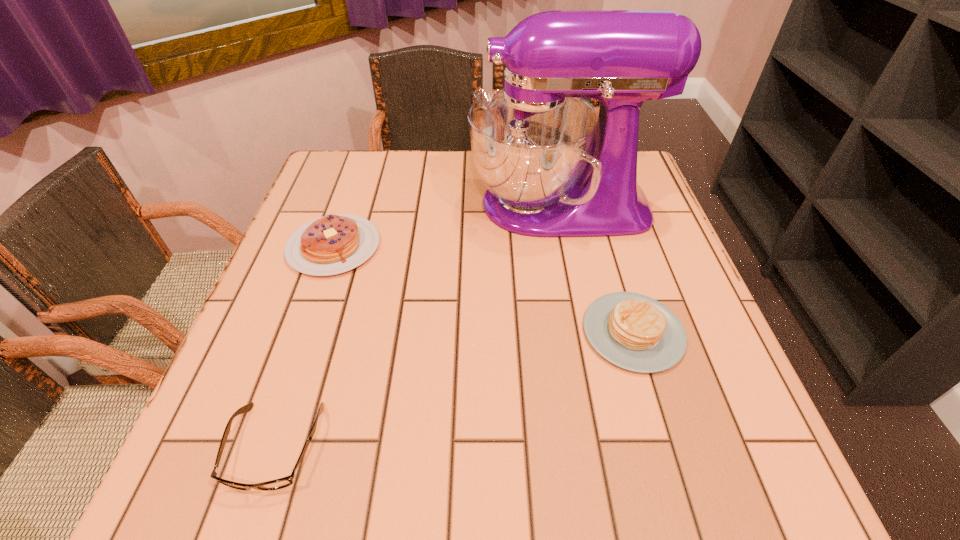
Find the location of `free spot between the mixer and the third farthest object`. free spot between the mixer and the third farthest object is located at coordinates (596, 268).

Find the location of a particular element. free area in between the spectacles and the third farthest object is located at coordinates (454, 389).

Locate an element on the screen. free space between the left pancake and the mixer is located at coordinates (446, 226).

The width and height of the screenshot is (960, 540). I want to click on object that is the third closest one to the right pancake, so click(284, 482).

The height and width of the screenshot is (540, 960). What are the coordinates of `the third closest object relative to the left pancake` in the screenshot? It's located at (635, 332).

Find the location of a particular element. The height and width of the screenshot is (540, 960). free spot that satisfies the following two spatial constraints: 1. at the bowl opening of the third farthest object; 2. on the left side of the mixer is located at coordinates (585, 332).

This screenshot has height=540, width=960. Identify the location of free location that satisfies the following two spatial constraints: 1. on the front side of the farther pancake; 2. on the left side of the second nearest object. (304, 332).